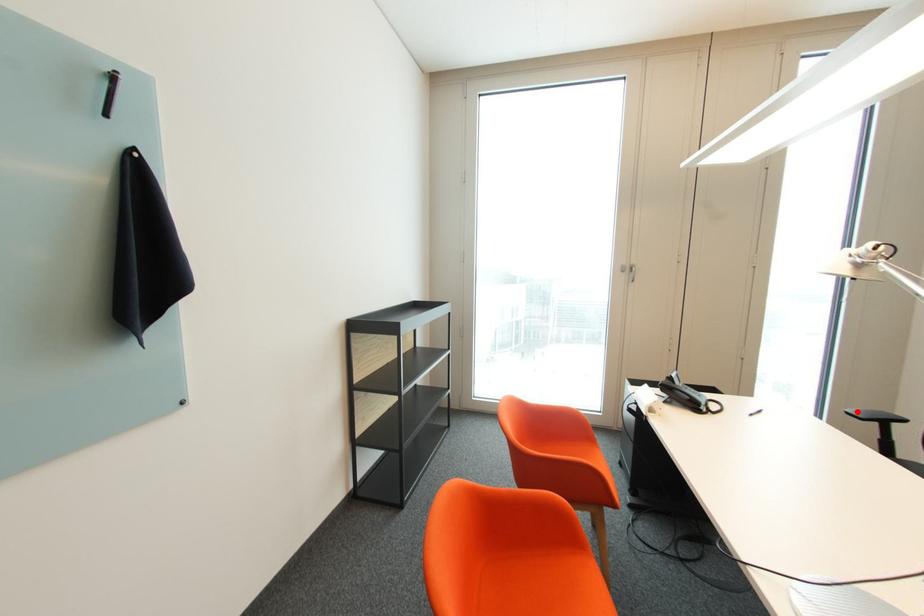
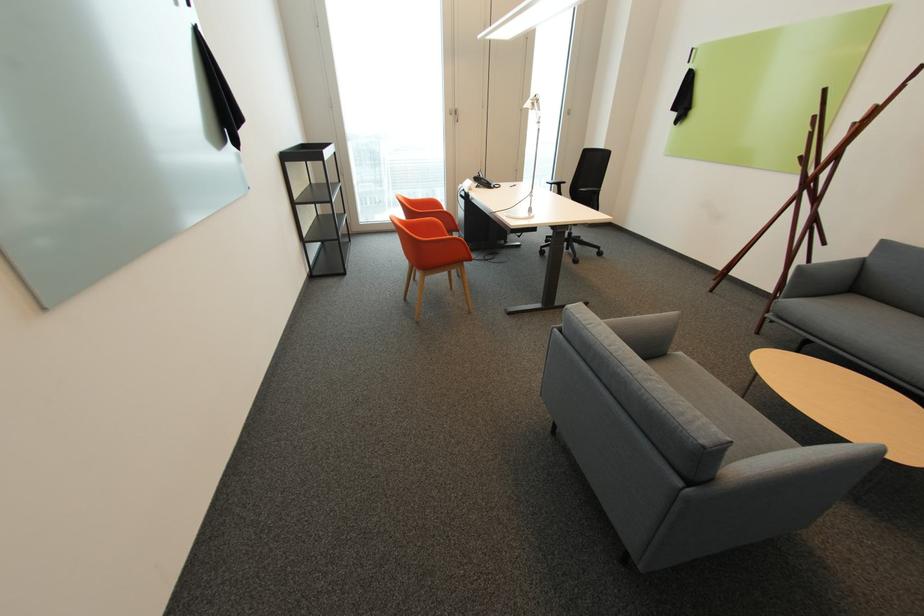
Find the pixel in the second image that matches the highlighted location in the first image.

(553, 182)